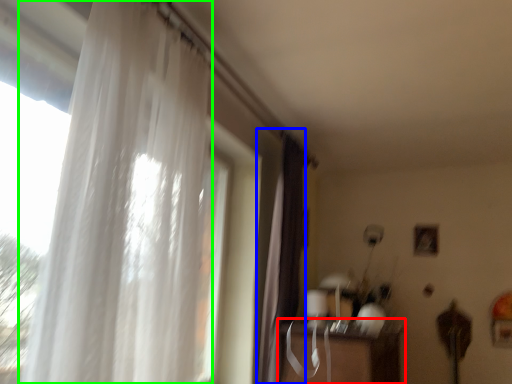
Question: Based on their relative distances, which object is farther from table (highlighted by a red box)? Choose from curtain (highlighted by a blue box) and curtain (highlighted by a green box).

Choices:
 (A) curtain
 (B) curtain

Answer: (B)